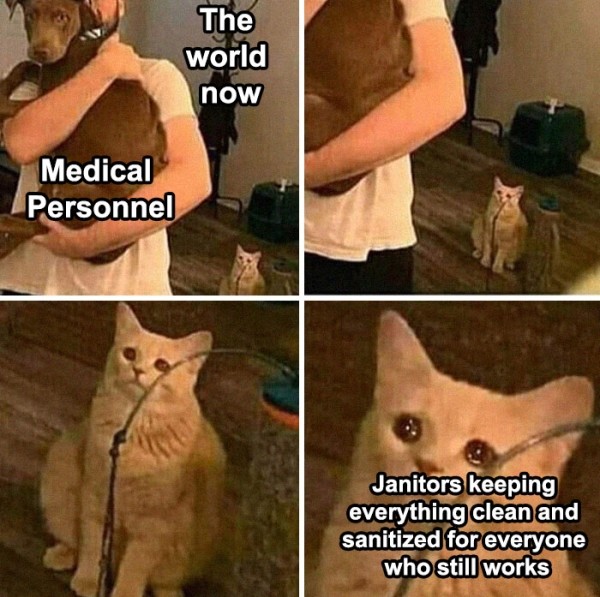
I want to click on four squares with photos in them, so click(258, 123), click(500, 162), click(231, 417), click(383, 450).